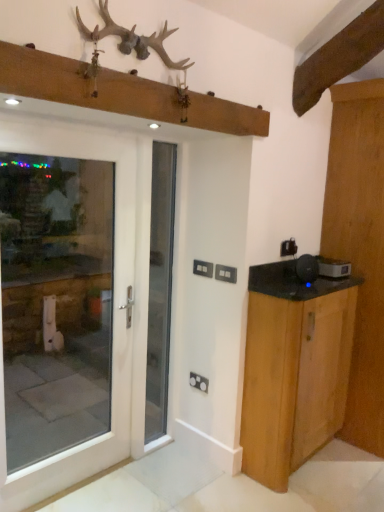
Question: From a real-world perspective, relative to white glass door at center, is white glass door at left, which ranks as the first door in front-to-back order, vertically above or below?

Choices:
 (A) above
 (B) below

Answer: (B)

Question: From the image's perspective, is white glass door at left, which appears as the 1th door when viewed from the left, located above or below white glass door at center?

Choices:
 (A) below
 (B) above

Answer: (A)

Question: Which of these objects is positioned closest to the black plastic speaker at right, the second appliance when ordered from back to front?

Choices:
 (A) wooden cabinet at right, which ranks as the second door in front-to-back order
 (B) white glass door at left, which appears as the 1th door when viewed from the left
 (C) white glass door at center
 (D) black plastic speaker at right, arranged as the second appliance when viewed from the left
 (E) light wood cabinet at right

Answer: (D)

Question: Considering the real-world distances, which object is closest to the white glass door at left, the second door viewed from the right?

Choices:
 (A) light wood cabinet at right
 (B) black plastic speaker at right, the 1th appliance positioned from the front
 (C) antlered wooden rack at upper center
 (D) black plastic speaker at right, the 2th appliance viewed from the front
 (E) wooden cabinet at right, acting as the 1th door starting from the back

Answer: (A)